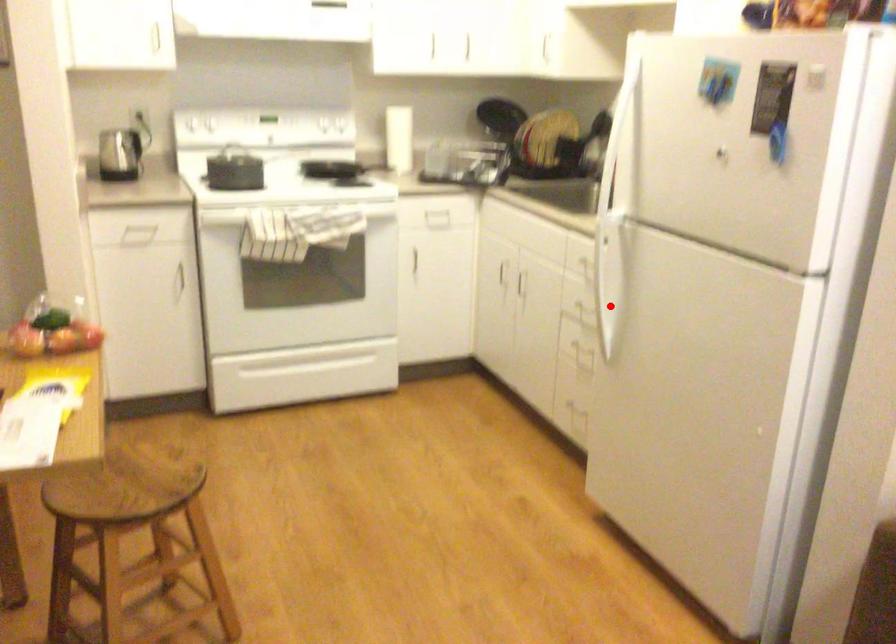
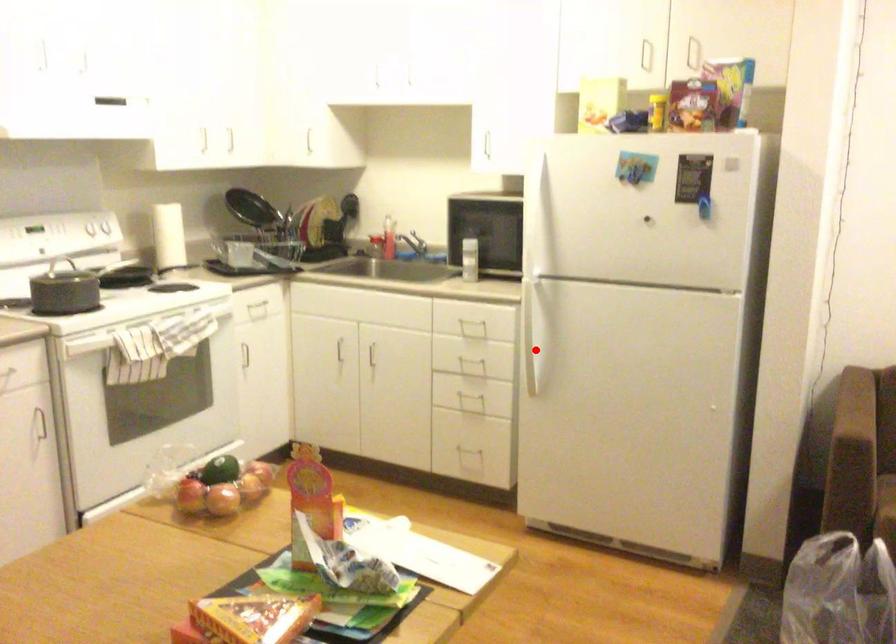
I am providing you with two images of the same scene from different viewpoints. A red point is marked on the first image and another point is marked on the second image. Is the red point in image1 aligned with the point shown in image2?

Yes